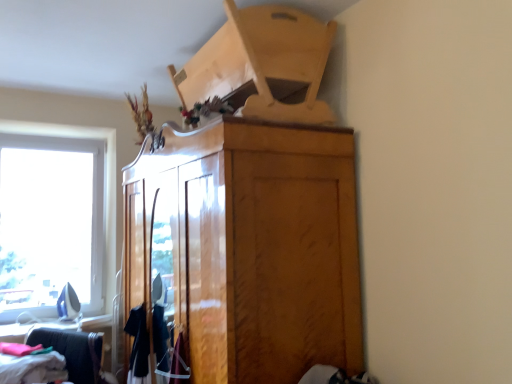
Question: Is velvet burgundy dress at lower center, arranged as the third clothing when viewed from the left, facing towards glossy wood cabinet at center?

Choices:
 (A) yes
 (B) no

Answer: (B)

Question: Is velvet burgundy dress at lower center, acting as the first clothing starting from the right, smaller than glossy wood cabinet at center?

Choices:
 (A) no
 (B) yes

Answer: (B)

Question: Can you see velvet burgundy dress at lower center, acting as the first clothing starting from the right, touching glossy wood cabinet at center?

Choices:
 (A) yes
 (B) no

Answer: (B)

Question: From the image's perspective, is velvet burgundy dress at lower center, acting as the first clothing starting from the right, located above glossy wood cabinet at center?

Choices:
 (A) yes
 (B) no

Answer: (B)

Question: Does velvet burgundy dress at lower center, arranged as the third clothing when viewed from the left, have a larger size compared to glossy wood cabinet at center?

Choices:
 (A) no
 (B) yes

Answer: (A)

Question: Visually, is matte black clothing at lower left positioned to the left or to the right of velvet burgundy dress at lower center, acting as the first clothing starting from the right?

Choices:
 (A) left
 (B) right

Answer: (A)

Question: Is matte black clothing at lower left in front of or behind velvet burgundy dress at lower center, arranged as the third clothing when viewed from the left, in the image?

Choices:
 (A) front
 (B) behind

Answer: (B)

Question: From a real-world perspective, is matte black clothing at lower left above or below velvet burgundy dress at lower center, acting as the first clothing starting from the right?

Choices:
 (A) below
 (B) above

Answer: (A)

Question: Considering the positions of matte black clothing at lower left and velvet burgundy dress at lower center, acting as the first clothing starting from the right, in the image, is matte black clothing at lower left taller or shorter than velvet burgundy dress at lower center, acting as the first clothing starting from the right,?

Choices:
 (A) short
 (B) tall

Answer: (B)

Question: From the image's perspective, is black fabric shirt at lower left, the second clothing in the left-to-right sequence, above or below matte black clothing at lower left?

Choices:
 (A) above
 (B) below

Answer: (A)

Question: Relative to matte black clothing at lower left, is black fabric shirt at lower left, positioned as the 2th clothing in right-to-left order, in front or behind?

Choices:
 (A) front
 (B) behind

Answer: (B)

Question: Visually, is black fabric shirt at lower left, the second clothing in the left-to-right sequence, positioned to the left or to the right of matte black clothing at lower left?

Choices:
 (A) left
 (B) right

Answer: (B)

Question: From a real-world perspective, relative to matte black clothing at lower left, is black fabric shirt at lower left, positioned as the 2th clothing in right-to-left order, vertically above or below?

Choices:
 (A) below
 (B) above

Answer: (B)

Question: Based on their sizes in the image, would you say soft cotton clothes at lower left, which is counted as the 1th clothing, starting from the left, is bigger or smaller than velvet burgundy dress at lower center, acting as the first clothing starting from the right?

Choices:
 (A) big
 (B) small

Answer: (A)

Question: Considering the positions of soft cotton clothes at lower left, which is counted as the 1th clothing, starting from the left, and velvet burgundy dress at lower center, acting as the first clothing starting from the right, in the image, is soft cotton clothes at lower left, which is counted as the 1th clothing, starting from the left, taller or shorter than velvet burgundy dress at lower center, acting as the first clothing starting from the right,?

Choices:
 (A) tall
 (B) short

Answer: (B)